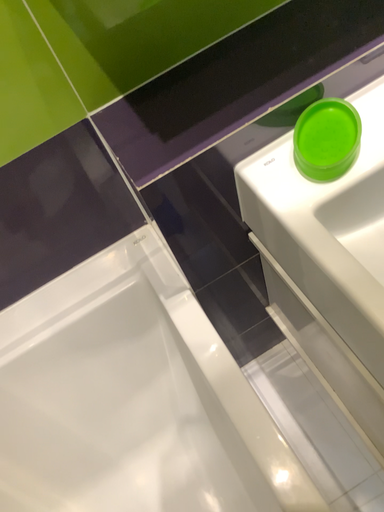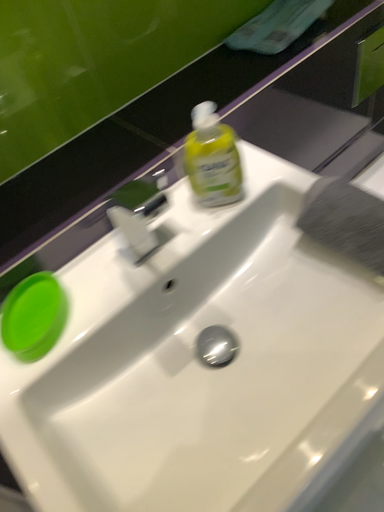
Question: How did the camera likely rotate when shooting the video?

Choices:
 (A) rotated right
 (B) rotated left

Answer: (A)